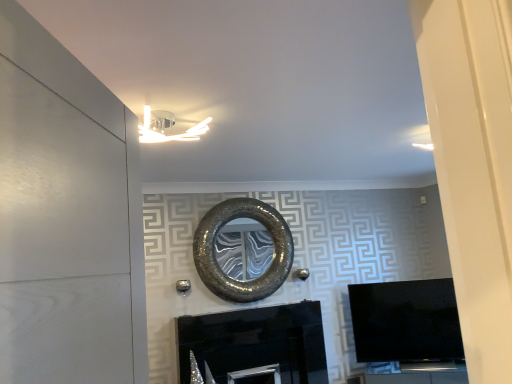
Question: Does point (136, 269) appear closer or farther from the camera than point (371, 334)?

Choices:
 (A) closer
 (B) farther

Answer: (A)

Question: From the image's perspective, is white matte door at left positioned above or below black glossy tv at right?

Choices:
 (A) above
 (B) below

Answer: (A)

Question: Considering the real-world distances, which object is closest to the black glossy tv at right?

Choices:
 (A) shiny metallic mirror at center
 (B) white matte door at left
 (C) black glossy fireplace at center

Answer: (C)

Question: Which is nearer to the shiny metallic mirror at center?

Choices:
 (A) black glossy tv at right
 (B) white matte door at left
 (C) black glossy fireplace at center

Answer: (C)